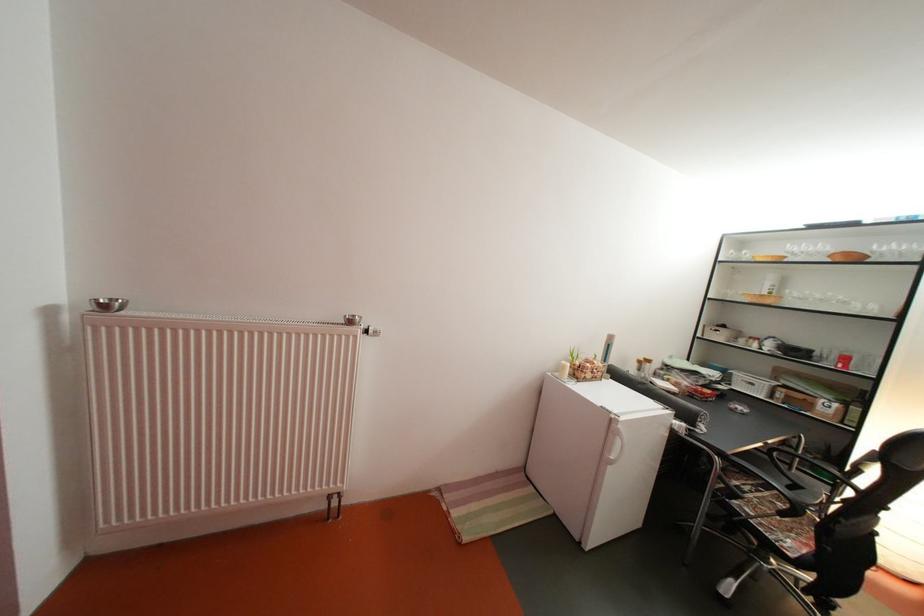
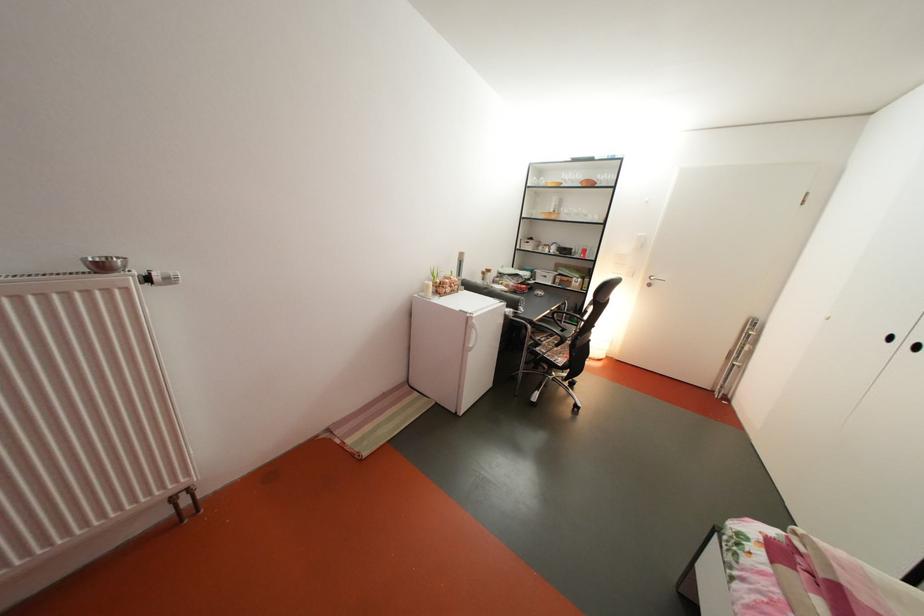
The point at (800,471) is marked in the first image. Where is the corresponding point in the second image?

(573, 328)